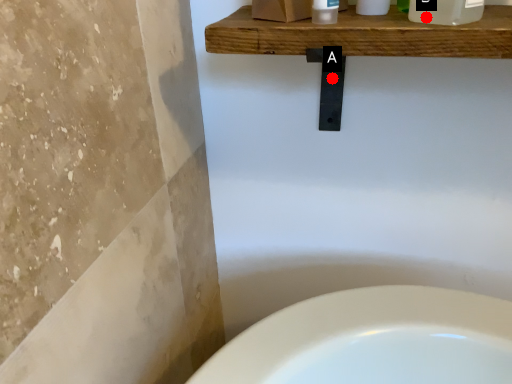
Question: Two points are circled on the image, labeled by A and B beside each circle. Which point is closer to the camera?

Choices:
 (A) A is closer
 (B) B is closer

Answer: (B)